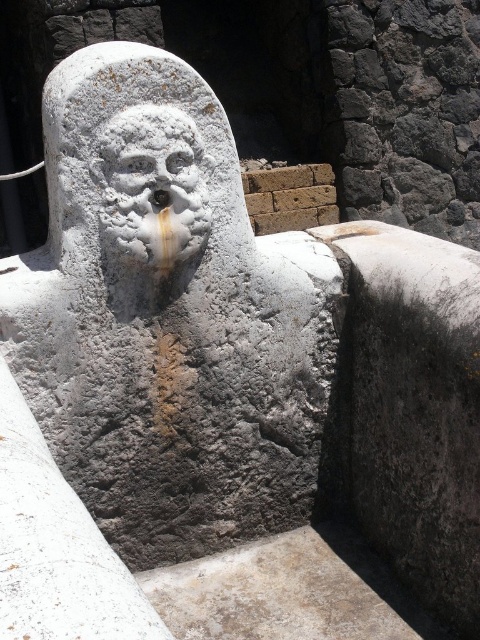
You are a tour guide standing 1.5 meters away from the white stone head at center. You want to show visitors the intricate details of its beard. Can you reach the beard without moving closer?

The white stone head at center is 1.64 meters away from the viewer. Since you are standing 1.5 meters away, you are closer than the stated distance, so you can reach the beard without needing to move closer.

You are an art restorer examining the weathered stone fountain. You notice the white stone head at center and the white stone face at center. Which part of the sculpture requires more material to repair due to its size?

The white stone head at center requires more material to repair because it is bigger than the white stone face at center.

You are a sculptor working on a stone fountain. You have two parts to attach together, the white stone head at center and the white stone face at center. The gap between them is 1.69 inches. Can you fit a standard 1.5 inch spacer between them to secure the pieces?

The distance between the white stone head at center and the white stone face at center is 1.69 inches. A standard 1.5 inch spacer would fit since it is slightly smaller than the gap.